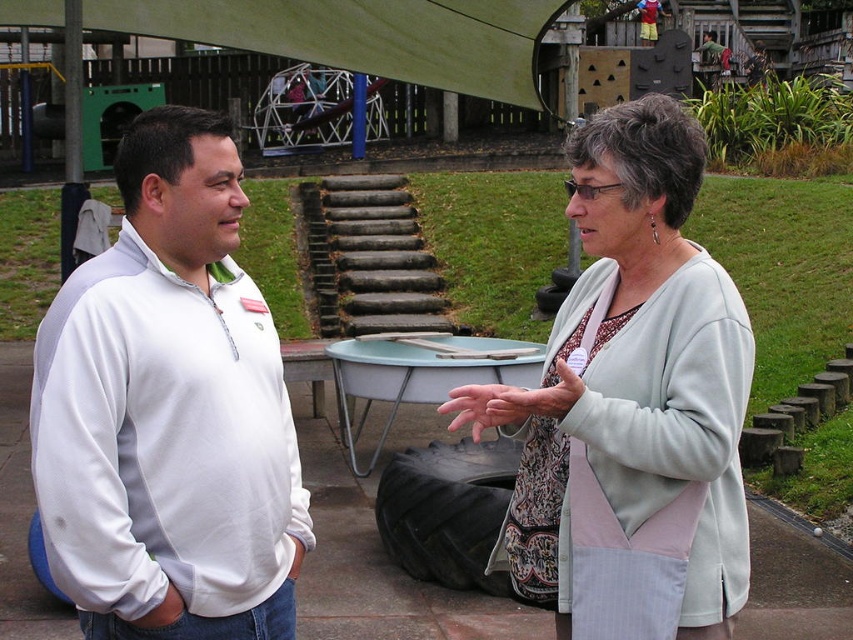
You are standing at point (90, 20) and want to walk to the playground equipment in the background. Which direction should you move relative to point (184, 579)?

You should move away from point (184, 579) because point (184, 579) is in front of point (90, 20), meaning the playground equipment is behind point (90, 20).